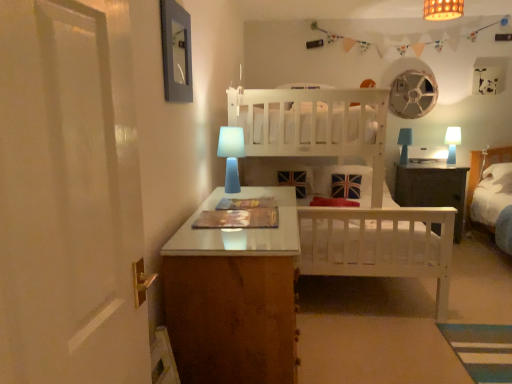
Identify the location of free space in front of blue matte table lamp at right, which ranks as the third table lamp in front-to-back order. The width and height of the screenshot is (512, 384). (409, 167).